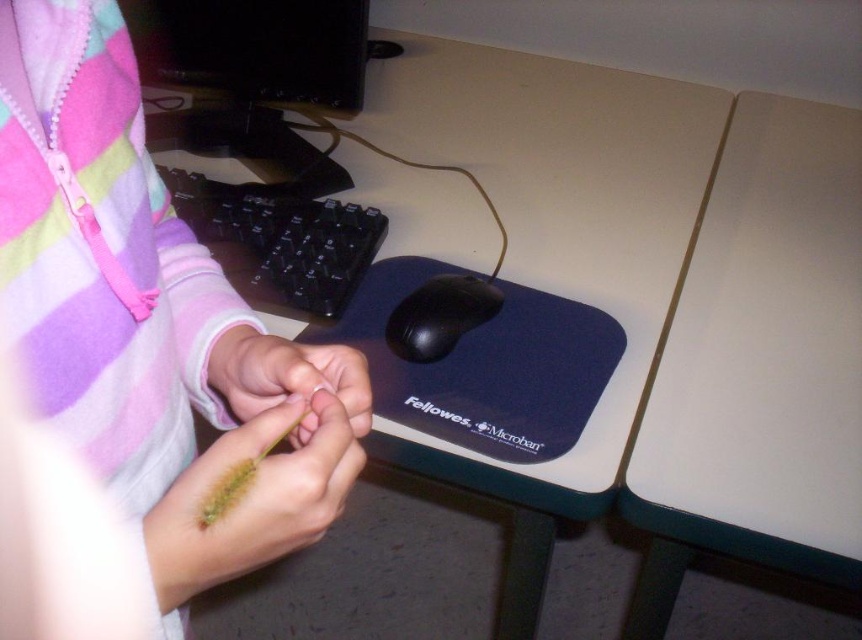
Question: Is pink fleece sweater at upper left to the left of green fuzzy stick at center from the viewer's perspective?

Choices:
 (A) yes
 (B) no

Answer: (A)

Question: Does white matte table at upper right appear over green fuzzy stick at center?

Choices:
 (A) yes
 (B) no

Answer: (A)

Question: Can you confirm if pink fleece sweater at upper left is positioned below white plastic table at center?

Choices:
 (A) yes
 (B) no

Answer: (A)

Question: Among these points, which one is nearest to the camera?

Choices:
 (A) (245, 483)
 (B) (692, 472)
 (C) (272, 369)

Answer: (A)

Question: Among these objects, which one is farthest from the camera?

Choices:
 (A) white matte table at upper right
 (B) black plastic monitor at upper left
 (C) green fuzzy stick at center
 (D) green matte string at center

Answer: (B)

Question: Which object is closer to the camera taking this photo?

Choices:
 (A) green matte string at center
 (B) black rubber mouse at center
 (C) black plastic keyboard at center-left
 (D) green fuzzy brush at center

Answer: (D)